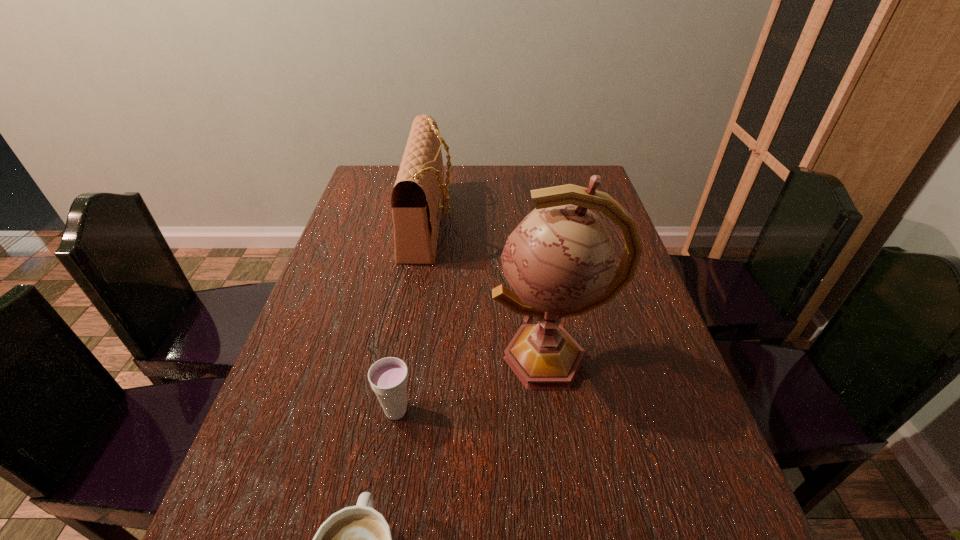
Locate an element on the screen. The width and height of the screenshot is (960, 540). object that is at the far edge is located at coordinates (416, 201).

Locate an element on the screen. object located in the right edge section of the desktop is located at coordinates (x=560, y=261).

In the image, there is a desktop. At what (x,y) coordinates should I click in order to perform the action: click on vacant space at the far edge. Please return your answer as a coordinate pair (x, y). Looking at the image, I should click on (473, 193).

The height and width of the screenshot is (540, 960). Find the location of `vacant area at the left edge`. vacant area at the left edge is located at coordinates (385, 216).

The width and height of the screenshot is (960, 540). In order to click on free space at the right edge of the desktop in this screenshot , I will do `click(649, 411)`.

The width and height of the screenshot is (960, 540). In order to click on blank space at the far left corner in this screenshot , I will do `click(370, 166)`.

In the image, there is a desktop. Find the location of `vacant space at the far right corner`. vacant space at the far right corner is located at coordinates (562, 174).

The image size is (960, 540). I want to click on free space between the farthest object and the cup, so click(413, 317).

At what (x,y) coordinates should I click in order to perform the action: click on unoccupied position between the cup and the globe. Please return your answer as a coordinate pair (x, y). Looking at the image, I should click on (473, 384).

Where is `vacant area between the farthest object and the cup`? This screenshot has width=960, height=540. vacant area between the farthest object and the cup is located at coordinates (413, 317).